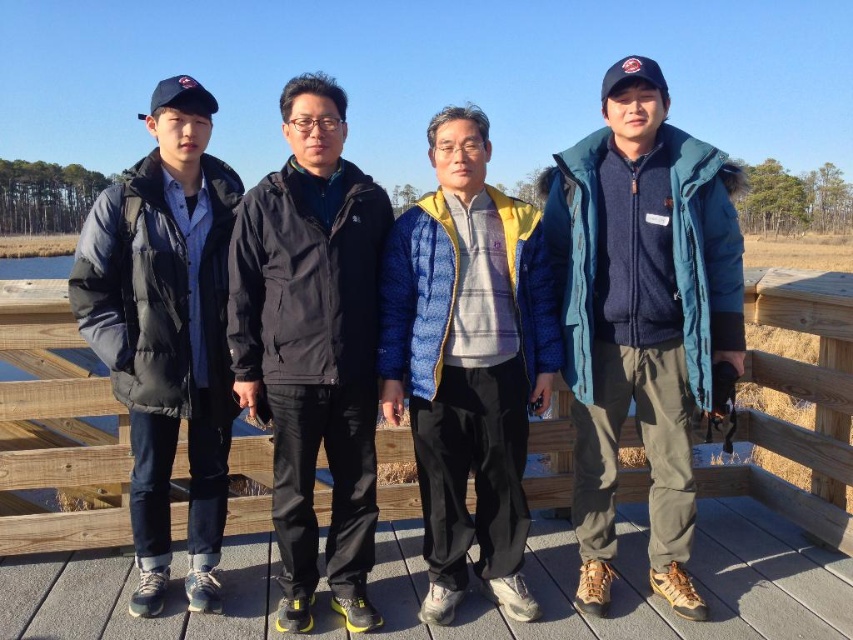
Describe the element at coordinates (312, 346) in the screenshot. I see `black matte jacket at center` at that location.

Who is more forward, (374, 474) or (163, 380)?

Point (163, 380) is more forward.

Find the location of a particular element. black matte jacket at center is located at coordinates (312, 346).

The width and height of the screenshot is (853, 640). I want to click on blue down jacket at center, so click(x=467, y=362).

Is blue down jacket at center shorter than wooden rail at center?

Yes.

Which is in front, point (440, 477) or point (712, 484)?

Point (440, 477) is more forward.

You are a GUI agent. You are given a task and a screenshot of the screen. Output one action in this format:
    pyautogui.click(x=<x>, y=<y>)
    Task: Click on the blue down jacket at center
    This screenshot has width=853, height=640.
    Given the screenshot: What is the action you would take?
    pyautogui.click(x=467, y=362)

Is teal fleece jacket at center below matte black jacket at left?

Correct, teal fleece jacket at center is located below matte black jacket at left.

Does teal fleece jacket at center lie in front of matte black jacket at left?

That is False.

Image resolution: width=853 pixels, height=640 pixels. Find the location of `teal fleece jacket at center`. teal fleece jacket at center is located at coordinates (642, 316).

The image size is (853, 640). In order to click on teal fleece jacket at center in this screenshot , I will do `click(642, 316)`.